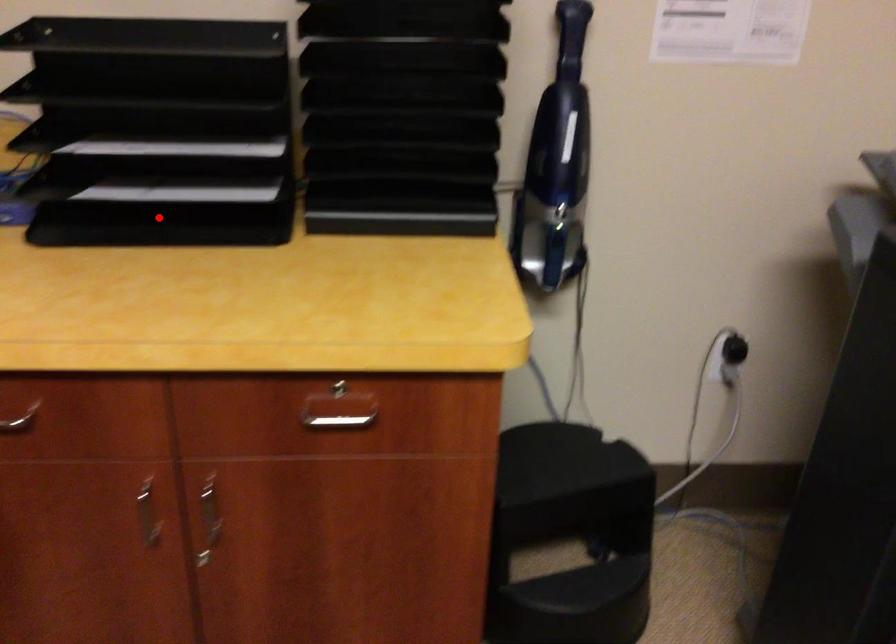
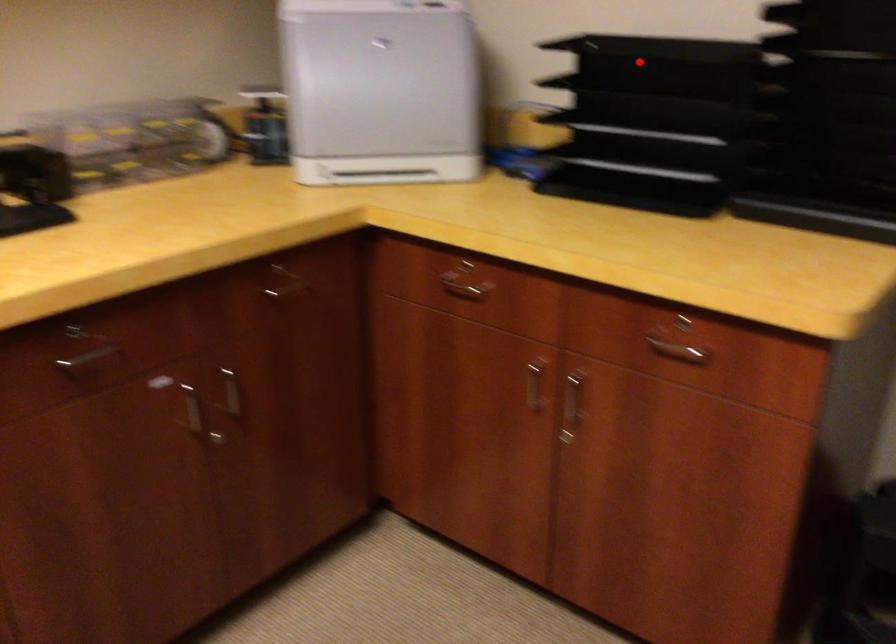
I am providing you with two images of the same scene from different viewpoints. A red point is marked on the first image and another point is marked on the second image. Is the marked point in image1 the same physical position as the marked point in image2?

No